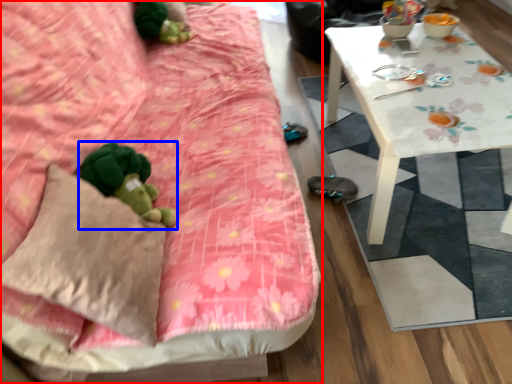
Question: Which of the following is the closest to the observer, studio couch (highlighted by a red box) or toy (highlighted by a blue box)?

Choices:
 (A) studio couch
 (B) toy

Answer: (A)